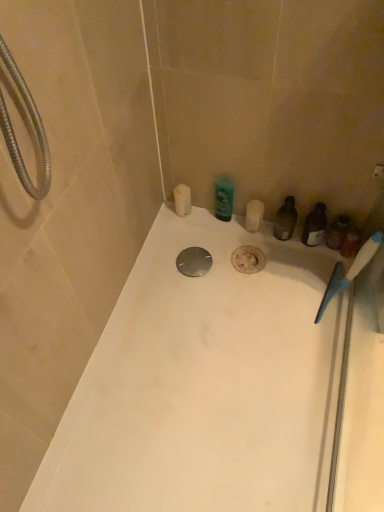
Identify the location of free space between translucent plastic bottle at right and green glossy bottle at center, acting as the second toiletry starting from the left. (246, 232).